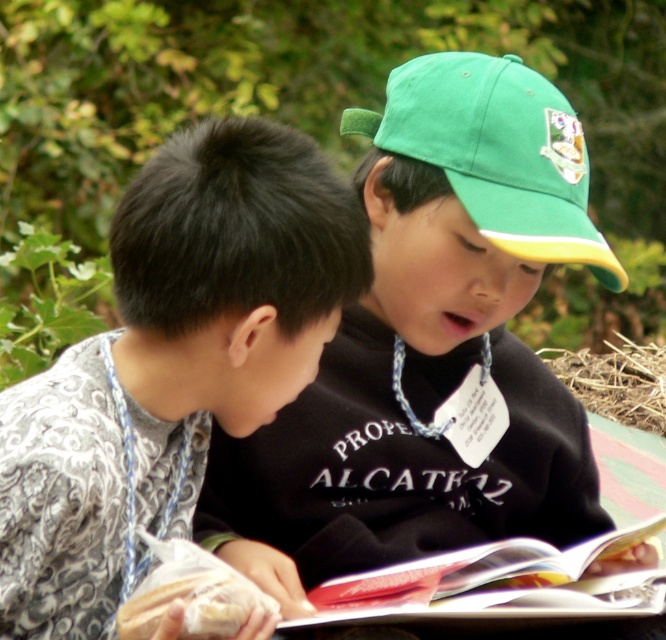
You are a photographer trying to capture a closeup of the green fabric cap at upper right without the paperback book at center blocking the view. Is this possible based on their positions?

The paperback book at center is behind the green fabric cap at upper right, so the photographer can take a closeup of the green fabric cap at upper right without the book blocking the view since it is positioned behind.